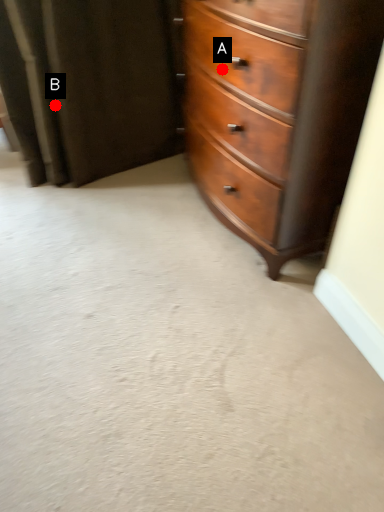
Question: Two points are circled on the image, labeled by A and B beside each circle. Which of the following is the farthest from the observer?

Choices:
 (A) A is further
 (B) B is further

Answer: (B)